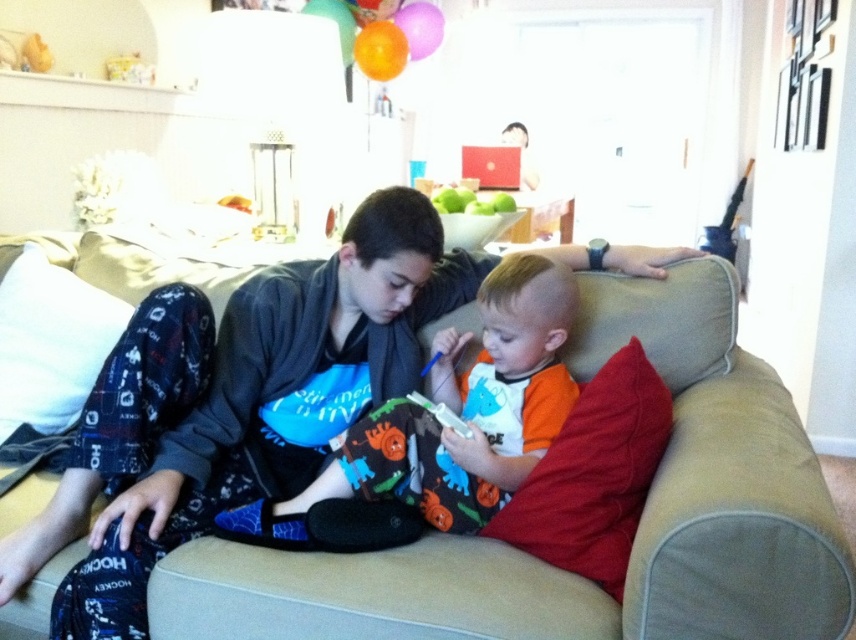
Question: Does beige fabric couch at center have a larger size compared to orange cotton shirt at center?

Choices:
 (A) yes
 (B) no

Answer: (A)

Question: Which of the following is the farthest from the observer?

Choices:
 (A) (355, 628)
 (B) (369, 534)

Answer: (B)

Question: Among these objects, which one is farthest from the camera?

Choices:
 (A) beige fabric couch at center
 (B) orange cotton shirt at center

Answer: (B)

Question: Which point is farther to the camera?

Choices:
 (A) orange cotton shirt at center
 (B) beige fabric couch at center

Answer: (A)

Question: Does beige fabric couch at center appear on the right side of orange cotton shirt at center?

Choices:
 (A) yes
 (B) no

Answer: (B)

Question: Can you confirm if beige fabric couch at center is bigger than orange cotton shirt at center?

Choices:
 (A) yes
 (B) no

Answer: (A)